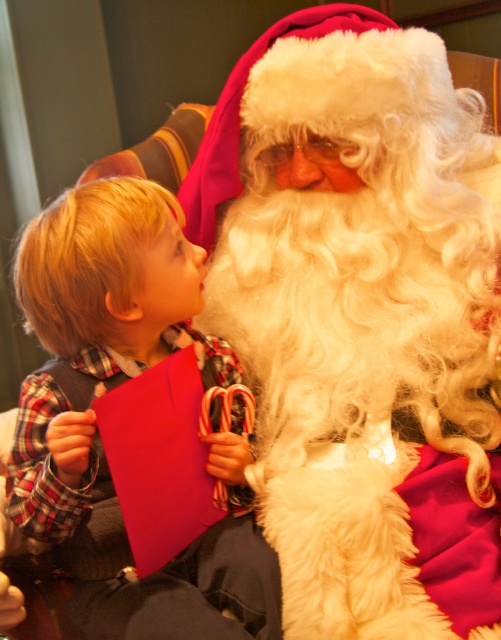
Question: Among these points, which one is farthest from the camera?

Choices:
 (A) (430, 292)
 (B) (233, 588)

Answer: (A)

Question: Does white fluffy beard at center come behind plaid fabric shirt at left?

Choices:
 (A) no
 (B) yes

Answer: (B)

Question: Among these points, which one is nearest to the camera?

Choices:
 (A) (323, 404)
 (B) (97, 182)

Answer: (B)

Question: Does white fluffy beard at center appear under plaid fabric shirt at left?

Choices:
 (A) yes
 (B) no

Answer: (B)

Question: Is white fluffy beard at center below plaid fabric shirt at left?

Choices:
 (A) no
 (B) yes

Answer: (A)